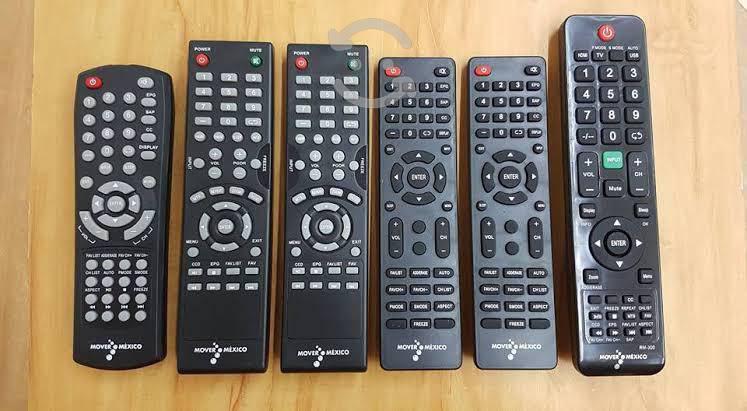
The height and width of the screenshot is (411, 747). What are the coordinates of `power buttons "on-off" on all remotes shown in image` in the screenshot? It's located at (93, 81), (199, 59), (300, 62), (394, 70), (483, 69), (607, 31).